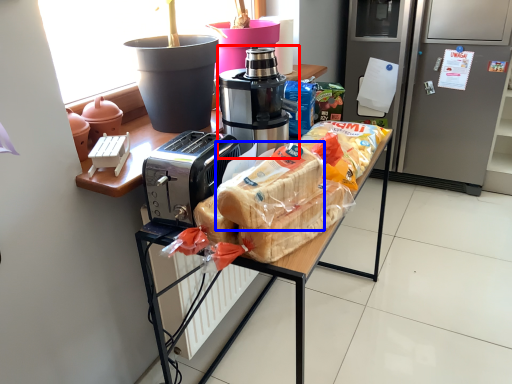
Question: Which object appears farthest to the camera in this image, coffee maker (highlighted by a red box) or snack (highlighted by a blue box)?

Choices:
 (A) coffee maker
 (B) snack

Answer: (A)